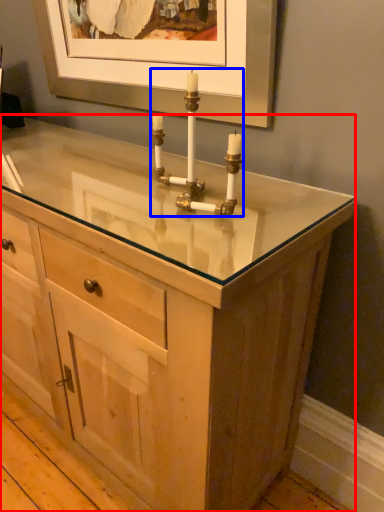
Question: Which object appears farthest to the camera in this image, chest of drawers (highlighted by a red box) or candle holder (highlighted by a blue box)?

Choices:
 (A) chest of drawers
 (B) candle holder

Answer: (B)